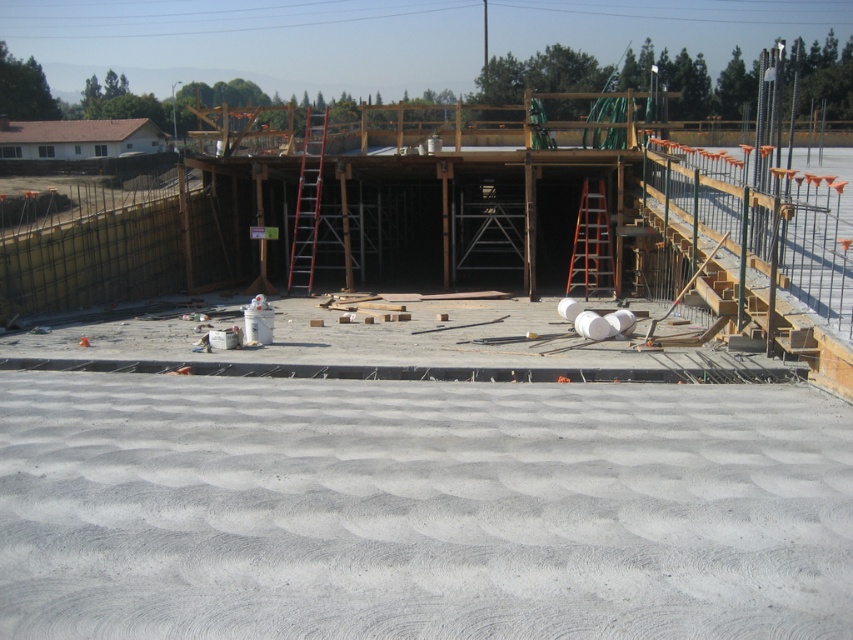
Question: Among these points, which one is farthest from the camera?

Choices:
 (A) (598, 273)
 (B) (299, 232)
 (C) (608, 506)

Answer: (B)

Question: Does smooth concrete floor at center appear under red metal ladder at center?

Choices:
 (A) yes
 (B) no

Answer: (A)

Question: Among these objects, which one is nearest to the camera?

Choices:
 (A) red metal ladder at center
 (B) orange metallic ladder at center

Answer: (B)

Question: Does smooth concrete floor at center appear on the left side of red metal ladder at center?

Choices:
 (A) yes
 (B) no

Answer: (B)

Question: Is red metal ladder at center to the left of orange metallic ladder at center from the viewer's perspective?

Choices:
 (A) no
 (B) yes

Answer: (B)

Question: Which point is farther from the camera taking this photo?

Choices:
 (A) (303, 602)
 (B) (303, 289)

Answer: (B)